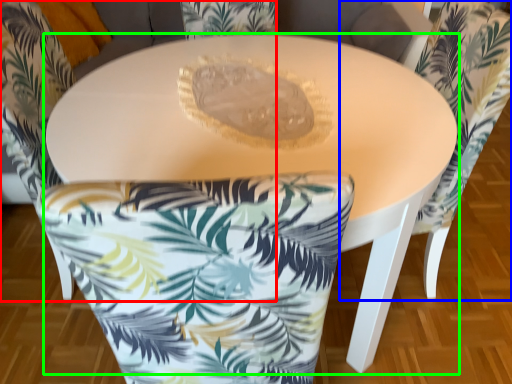
Question: Considering the real-world distances, which object is farthest from chair (highlighted by a red box)? chair (highlighted by a blue box) or table (highlighted by a green box)?

Choices:
 (A) chair
 (B) table

Answer: (A)